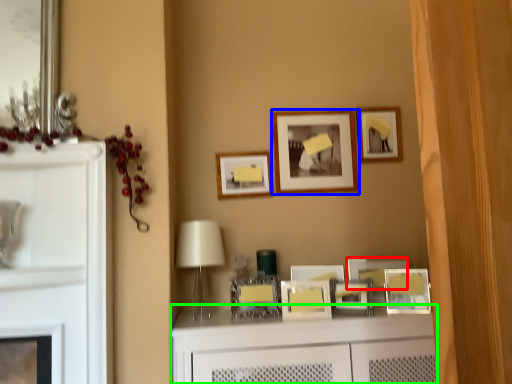
Question: Estimate the real-world distances between objects in this image. Which object is closer to picture frame (highlighted by a red box), picture frame (highlighted by a blue box) or vanity (highlighted by a green box)?

Choices:
 (A) picture frame
 (B) vanity

Answer: (B)